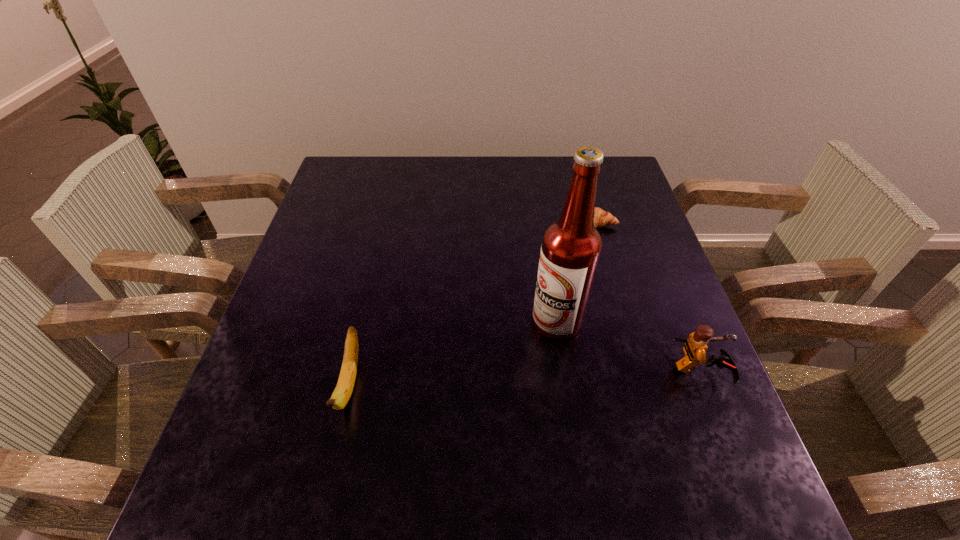
You are a GUI agent. You are given a task and a screenshot of the screen. Output one action in this format:
    pyautogui.click(x=<x>, y=<y>)
    Task: Click on the vacant space on the desktop that is between the banana and the Lego and is positioned on the front-facing side of the farthest object
    
    Given the screenshot: What is the action you would take?
    pyautogui.click(x=564, y=375)

The width and height of the screenshot is (960, 540). I want to click on free space on the desktop that is between the leftmost object and the third shortest object and is positioned on the label side of the alcohol, so click(x=494, y=379).